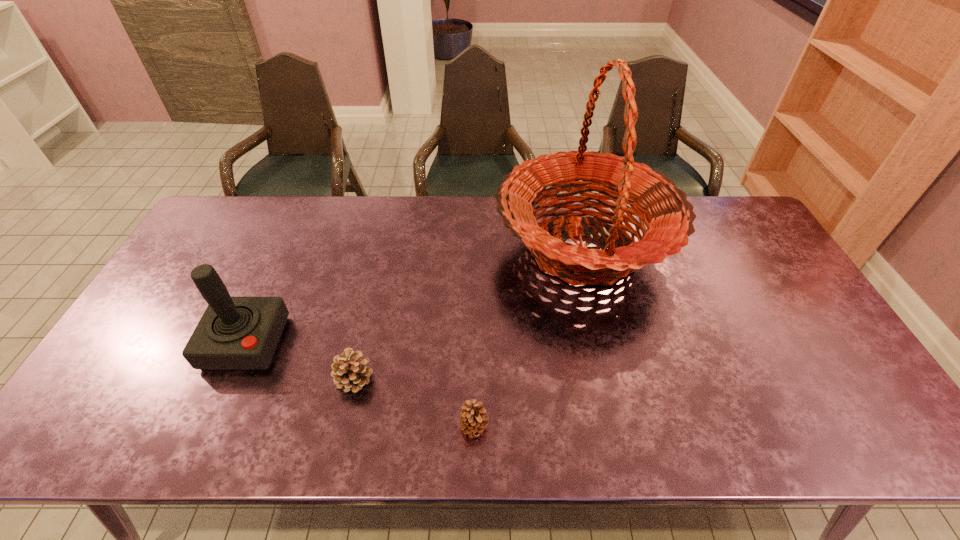
Where is `free point between the rightmost object and the leftmost object`? free point between the rightmost object and the leftmost object is located at coordinates (414, 295).

Image resolution: width=960 pixels, height=540 pixels. I want to click on vacant area that lies between the nearer pinecone and the left pinecone, so point(414,403).

Identify the location of vacant space that's between the basket and the third shortest object. (414, 295).

Locate an element on the screen. vacant space in between the nearest object and the second object from left to right is located at coordinates (414, 403).

Find the location of `free area in between the third shortest object and the farther pinecone`. free area in between the third shortest object and the farther pinecone is located at coordinates (300, 361).

Image resolution: width=960 pixels, height=540 pixels. I want to click on free space between the basket and the second object from left to right, so click(x=468, y=313).

Identify which object is located as the second nearest to the second object from left to right. Please provide its 2D coordinates. Your answer should be formatted as a tuple, i.e. [(x, y)], where the tuple contains the x and y coordinates of a point satisfying the conditions above.

[(473, 418)]

Locate which object is the closest to the nearer pinecone. Please provide its 2D coordinates. Your answer should be formatted as a tuple, i.e. [(x, y)], where the tuple contains the x and y coordinates of a point satisfying the conditions above.

[(349, 371)]

Locate an element on the screen. vacant space that satisfies the following two spatial constraints: 1. on the base of the third shortest object; 2. on the left side of the nearer pinecone is located at coordinates (208, 427).

Where is `free space that satisfies the following two spatial constraints: 1. on the back side of the rightmost object; 2. on the right side of the second object from right to left`? free space that satisfies the following two spatial constraints: 1. on the back side of the rightmost object; 2. on the right side of the second object from right to left is located at coordinates (476, 248).